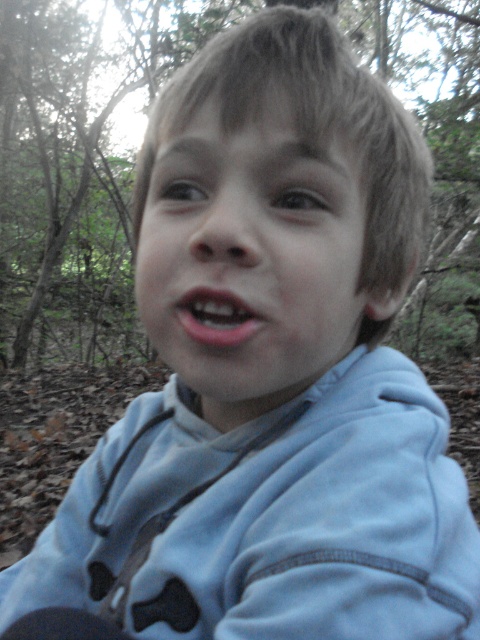
Measure the distance from light blue fleece jacket at center to pink matte lips at center.

light blue fleece jacket at center and pink matte lips at center are 18.06 centimeters apart.

Between light blue fleece jacket at center and pink matte lips at center, which one appears on the right side from the viewer's perspective?

Positioned to the right is pink matte lips at center.

Who is more distant from viewer, (108, 586) or (232, 332)?

The point (108, 586) is behind.

You are a GUI agent. You are given a task and a screenshot of the screen. Output one action in this format:
    pyautogui.click(x=<x>, y=<y>)
    Task: Click on the light blue fleece jacket at center
    
    Given the screenshot: What is the action you would take?
    pyautogui.click(x=267, y=518)

Can you confirm if smooth skin face at center is positioned below pink matte lips at center?

No.

Where is `smooth skin face at center`? The image size is (480, 640). smooth skin face at center is located at coordinates (250, 260).

What do you see at coordinates (267, 518) in the screenshot?
I see `light blue fleece jacket at center` at bounding box center [267, 518].

Identify the location of light blue fleece jacket at center. (267, 518).

Who is more forward, (163, 618) or (223, 196)?

Point (223, 196) is more forward.

Locate an element on the screen. This screenshot has width=480, height=640. light blue fleece jacket at center is located at coordinates (267, 518).